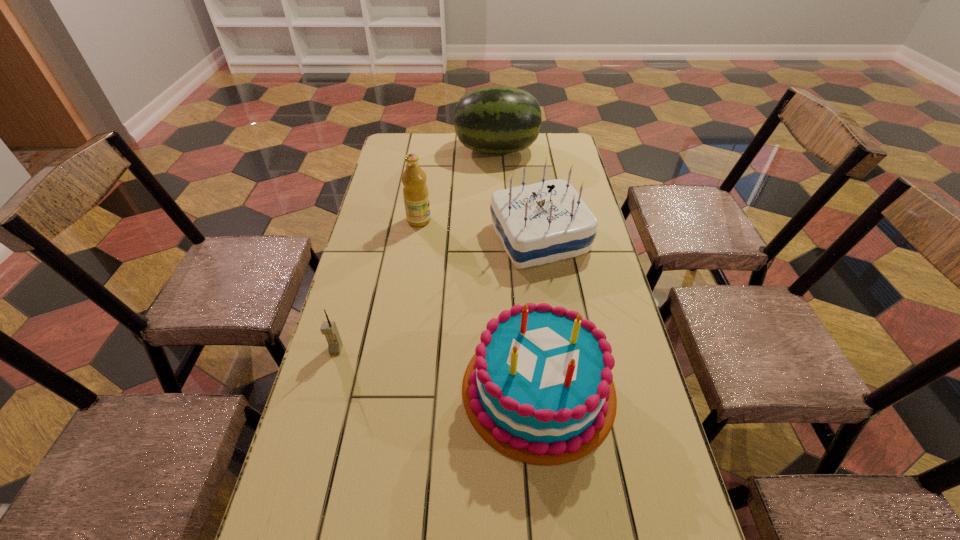
The image size is (960, 540). In order to click on watermelon in this screenshot , I will do point(498,119).

You are a GUI agent. You are given a task and a screenshot of the screen. Output one action in this format:
    pyautogui.click(x=<x>, y=<y>)
    Task: Click on the second object from left to right
    The width and height of the screenshot is (960, 540).
    Given the screenshot: What is the action you would take?
    tap(415, 191)

Where is `the farther birthday cake`? the farther birthday cake is located at coordinates (544, 222).

Locate an element on the screen. The image size is (960, 540). the nearer birthday cake is located at coordinates (538, 387).

Locate an element on the screen. This screenshot has height=540, width=960. the leftmost object is located at coordinates (328, 328).

Find the location of a particular element. The width and height of the screenshot is (960, 540). the shortest object is located at coordinates (328, 328).

Image resolution: width=960 pixels, height=540 pixels. In order to click on vacant space located 0.120m on the right of the farthest object in this screenshot , I will do `click(567, 150)`.

You are a GUI agent. You are given a task and a screenshot of the screen. Output one action in this format:
    pyautogui.click(x=<x>, y=<y>)
    Task: Click on the vacant space located 0.280m on the label of the olive oil
    
    Given the screenshot: What is the action you would take?
    pyautogui.click(x=515, y=220)

Locate an element on the screen. vacant space located on the front of the farther birthday cake is located at coordinates (558, 360).

Locate an element on the screen. vacant space located on the left of the nearer birthday cake is located at coordinates (427, 389).